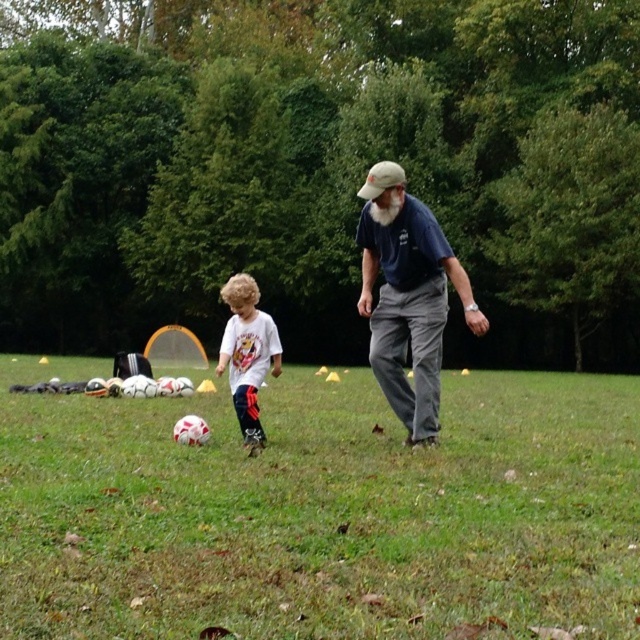
Question: Does green grass at center have a larger size compared to white matte shirt at center?

Choices:
 (A) yes
 (B) no

Answer: (A)

Question: Which of these objects is positioned farthest from the green grass at center?

Choices:
 (A) white matte shirt at center
 (B) dark blue shirt at center

Answer: (B)

Question: In this image, where is green grass at center located relative to dark blue shirt at center?

Choices:
 (A) below
 (B) above

Answer: (A)

Question: Considering the real-world distances, which object is farthest from the green grass at center?

Choices:
 (A) white matte shirt at center
 (B) dark blue shirt at center

Answer: (B)

Question: Can you confirm if green grass at center is smaller than white matte shirt at center?

Choices:
 (A) yes
 (B) no

Answer: (B)

Question: Considering the real-world distances, which object is farthest from the dark blue shirt at center?

Choices:
 (A) white matte shirt at center
 (B) green grass at center

Answer: (B)